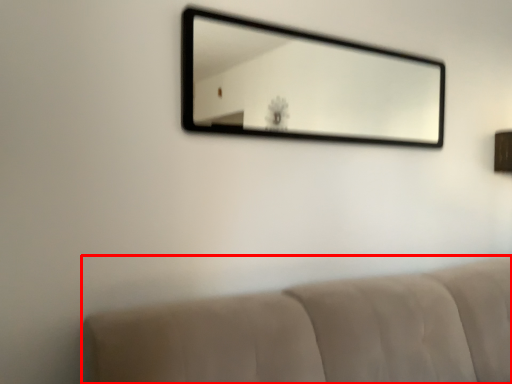
Question: From the image, what is the correct spatial relationship of furniture (annotated by the red box) in relation to mirror?

Choices:
 (A) right
 (B) left

Answer: (B)